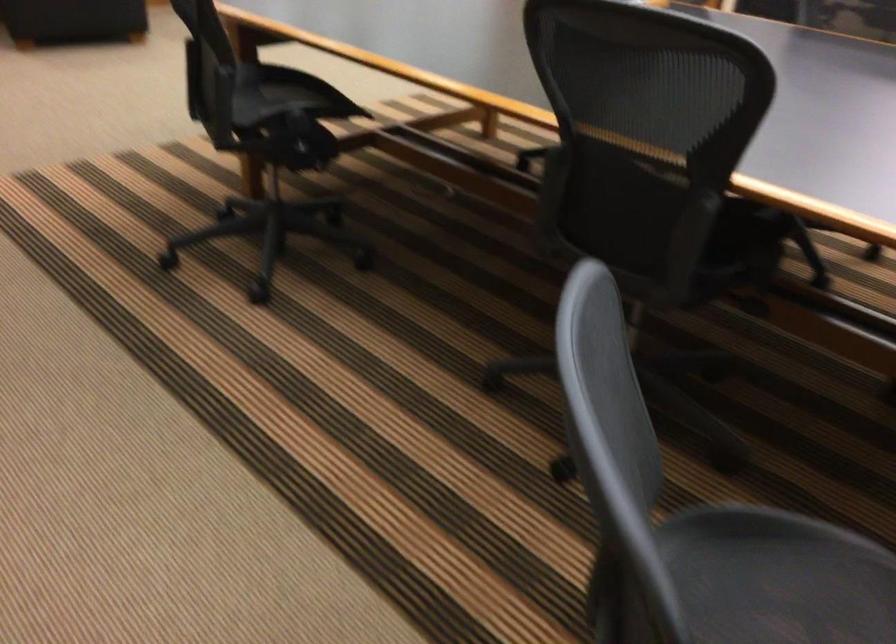
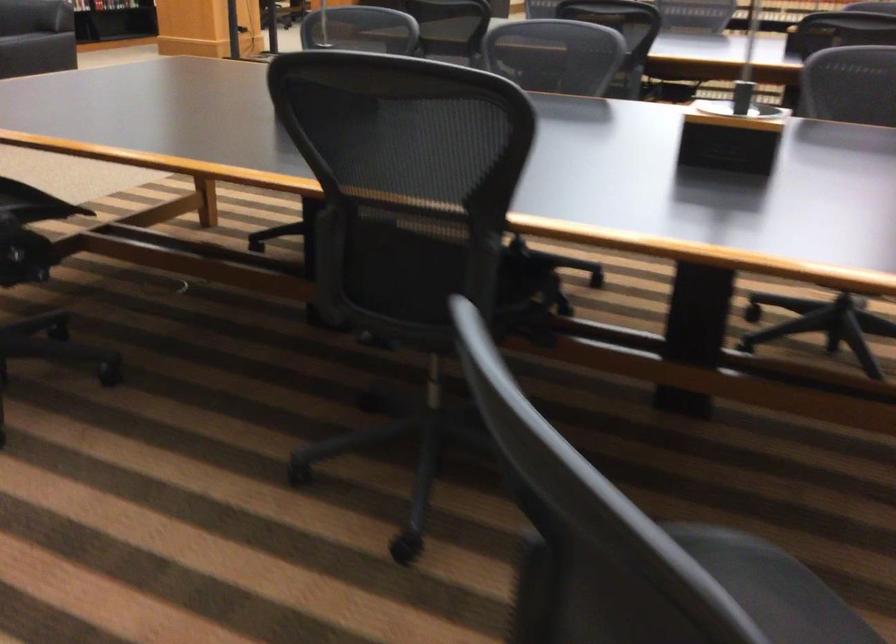
In the second image, find the point that corresponds to pixel 751 237 in the first image.

(530, 277)